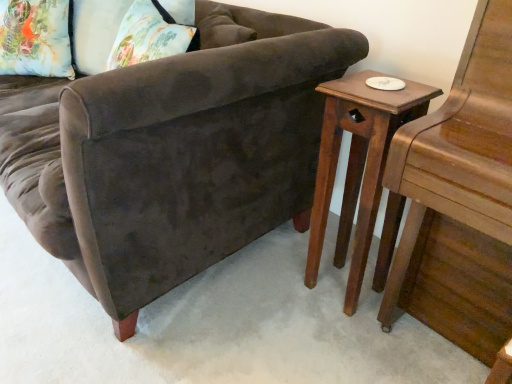
Question: Does wooden side table at right have a lesser height compared to floral fabric pillow at upper left?

Choices:
 (A) no
 (B) yes

Answer: (A)

Question: Is wooden side table at right outside of floral fabric pillow at upper left?

Choices:
 (A) no
 (B) yes

Answer: (B)

Question: Is wooden side table at right positioned far away from floral fabric pillow at upper left?

Choices:
 (A) yes
 (B) no

Answer: (A)

Question: Can you confirm if wooden side table at right is thinner than floral fabric pillow at upper left?

Choices:
 (A) no
 (B) yes

Answer: (A)

Question: Would you say floral fabric pillow at upper left is part of wooden side table at right's contents?

Choices:
 (A) yes
 (B) no

Answer: (B)

Question: Considering the relative positions of wooden side table at right and floral fabric pillow at upper left in the image provided, is wooden side table at right to the left of floral fabric pillow at upper left from the viewer's perspective?

Choices:
 (A) no
 (B) yes

Answer: (A)

Question: Is wooden side table at right wider than velvet brown couch at center?

Choices:
 (A) no
 (B) yes

Answer: (A)

Question: From a real-world perspective, does wooden side table at right stand above velvet brown couch at center?

Choices:
 (A) no
 (B) yes

Answer: (A)

Question: Is wooden side table at right next to velvet brown couch at center and touching it?

Choices:
 (A) yes
 (B) no

Answer: (B)

Question: Can velvet brown couch at center be found inside wooden side table at right?

Choices:
 (A) no
 (B) yes

Answer: (A)

Question: Can you confirm if wooden side table at right is smaller than velvet brown couch at center?

Choices:
 (A) no
 (B) yes

Answer: (B)

Question: From the image's perspective, is wooden side table at right over velvet brown couch at center?

Choices:
 (A) no
 (B) yes

Answer: (A)

Question: From a real-world perspective, is floral fabric pillow at upper left located higher than velvet brown couch at center?

Choices:
 (A) yes
 (B) no

Answer: (A)